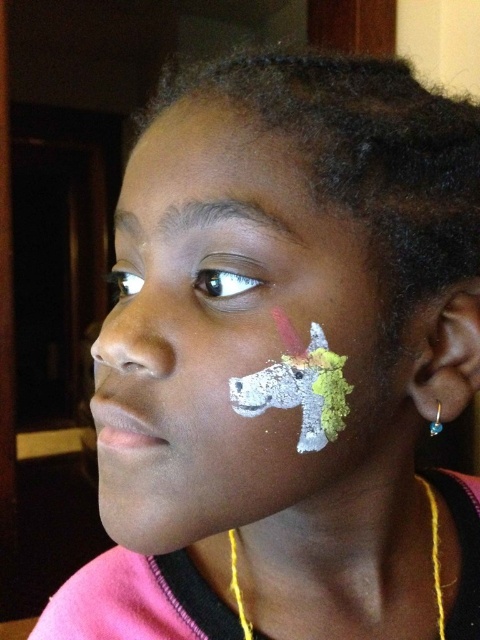
Does shiny blue eye at upper left have a smaller size compared to gold metallic earring at ear?

Correct, shiny blue eye at upper left occupies less space than gold metallic earring at ear.

Who is positioned more to the left, shiny blue eye at upper left or gold metallic earring at ear?

From the viewer's perspective, shiny blue eye at upper left appears more on the left side.

Locate an element on the screen. shiny blue eye at upper left is located at coordinates (224, 284).

Can you confirm if matte skin at upper center is positioned above matte white nose at upper left?

Yes.

At what (x,y) coordinates should I click in order to perform the action: click on matte skin at upper center. Please return your answer as a coordinate pair (x, y). Looking at the image, I should click on (213, 166).

The width and height of the screenshot is (480, 640). I want to click on matte skin at upper center, so click(x=213, y=166).

Locate an element on the screen. matte skin at upper center is located at coordinates (213, 166).

Image resolution: width=480 pixels, height=640 pixels. Identify the location of matte skin at upper center. (213, 166).